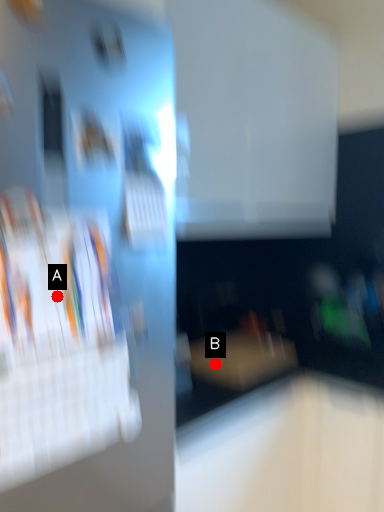
Question: Two points are circled on the image, labeled by A and B beside each circle. Which point is closer to the camera?

Choices:
 (A) A is closer
 (B) B is closer

Answer: (A)